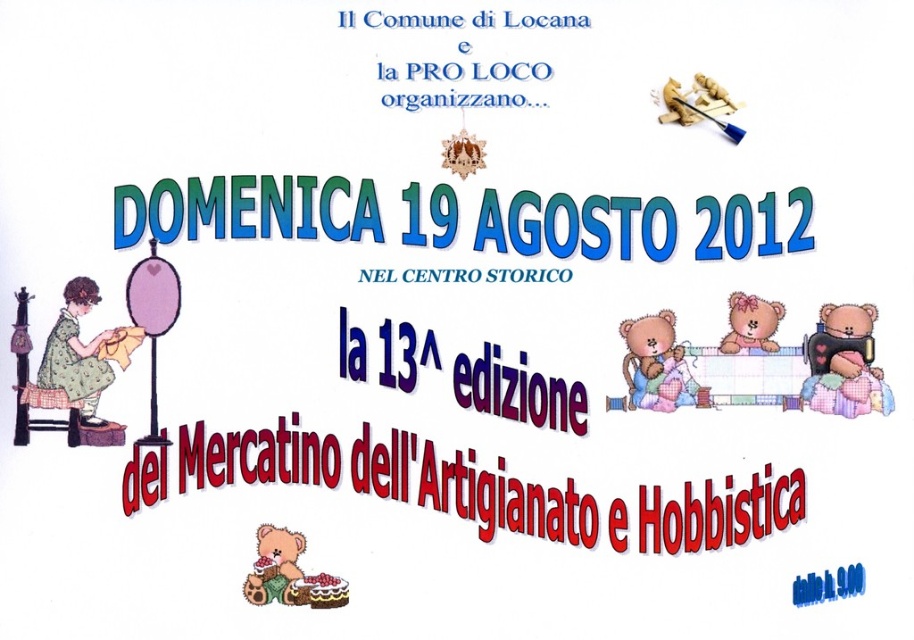
Question: Is fluffy pink teddy at upper right further to the viewer compared to pink fabric teddy bear at upper right?

Choices:
 (A) no
 (B) yes

Answer: (A)

Question: Does fluffy pink teddy bear at right have a greater width compared to pink fabric teddy bear at upper right?

Choices:
 (A) no
 (B) yes

Answer: (B)

Question: Which of the following is the closest to the observer?

Choices:
 (A) wooden stool at lower left
 (B) fluffy beige teddy bear at lower left
 (C) fluffy pink teddy at upper right

Answer: (B)

Question: Which of the following is the farthest from the observer?

Choices:
 (A) fluffy pink teddy bear at right
 (B) pink fabric teddy bear at upper right

Answer: (A)

Question: Is fluffy pink teddy bear at right bigger than wooden stool at lower left?

Choices:
 (A) no
 (B) yes

Answer: (A)

Question: Which object appears closest to the camera in this image?

Choices:
 (A) fluffy beige teddy bear at lower left
 (B) fluffy pink teddy bear at right
 (C) wooden stool at lower left

Answer: (A)